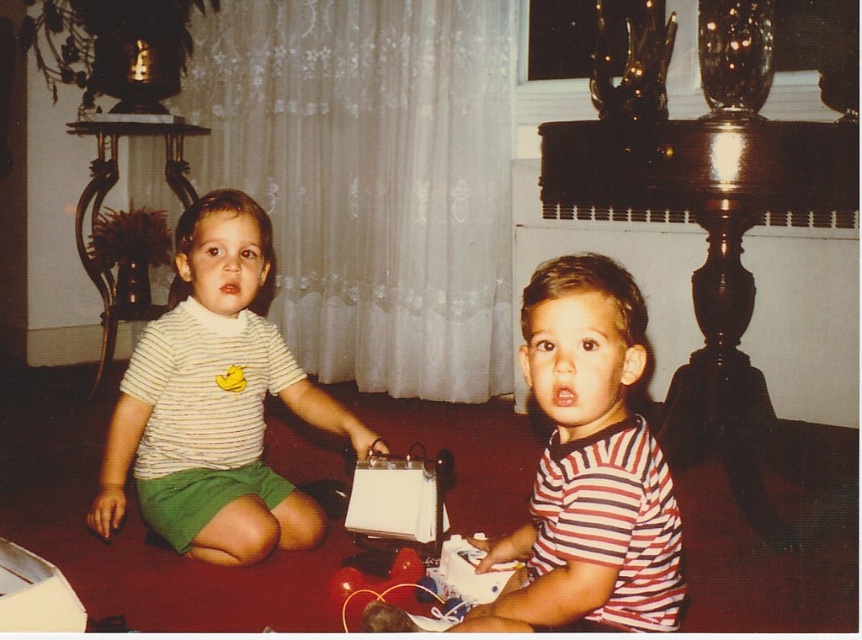
Where is the matte striped shirt at center located in the image?

The matte striped shirt at center is located at point [216,403] in the image.